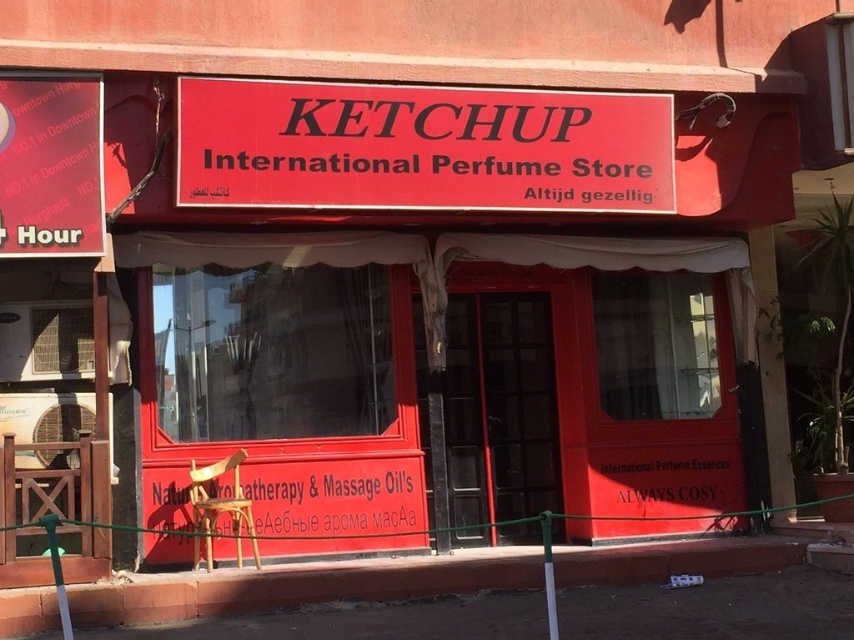
Measure the distance between red matte sign at center and camera.

red matte sign at center and camera are 23.27 feet apart from each other.

Is red matte sign at center behind white matte signboard at center?

No.

Is point (442, 172) farther from camera compared to point (145, 497)?

Yes, it is.

In order to click on red matte sign at center in this screenshot , I will do `click(420, 147)`.